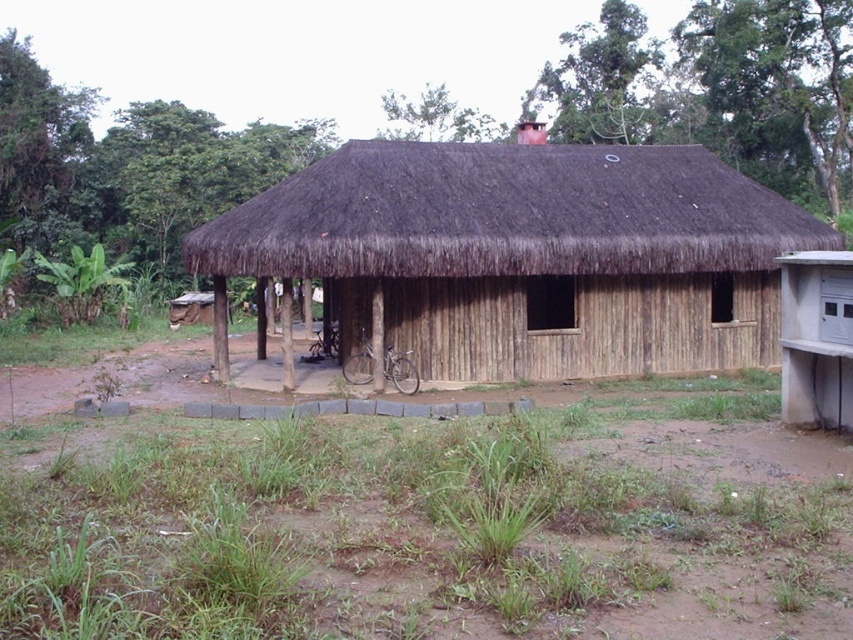
In the scene shown: Which is above, brown dirt field at center or brown thatch at center?

brown thatch at center is above.

Is the position of brown dirt field at center more distant than that of brown thatch at center?

No, it is not.

Between point (538, 596) and point (463, 168), which one is positioned in front?

Positioned in front is point (538, 596).

Image resolution: width=853 pixels, height=640 pixels. Identify the location of brown dirt field at center. (432, 520).